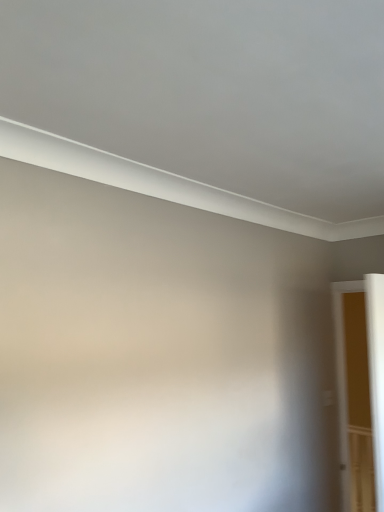
Based on the photo, measure the distance between point (x=357, y=281) and camera.

They are 8.33 feet apart.

Describe the element at coordinates (369, 376) in the screenshot. The width and height of the screenshot is (384, 512). I see `white glossy screen door at right` at that location.

The image size is (384, 512). I want to click on white glossy screen door at right, so (x=369, y=376).

Find the location of a particular element. white glossy screen door at right is located at coordinates (369, 376).